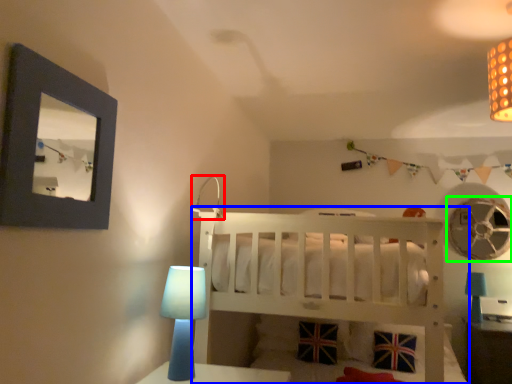
Question: Based on their relative distances, which object is nearer to lamp (highlighted by a red box)? Choose from infant bed (highlighted by a blue box) and mechanical fan (highlighted by a green box).

Choices:
 (A) infant bed
 (B) mechanical fan

Answer: (A)